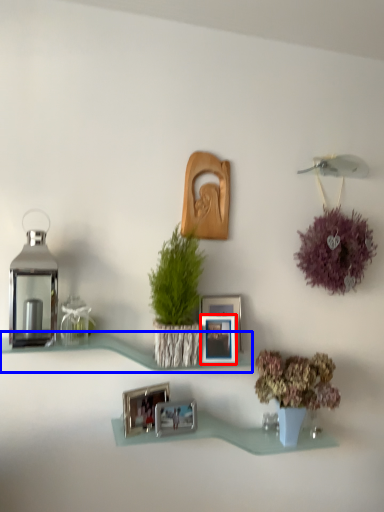
Question: Which object appears farthest to the camera in this image, picture frame (highlighted by a red box) or shelf (highlighted by a blue box)?

Choices:
 (A) picture frame
 (B) shelf

Answer: (A)